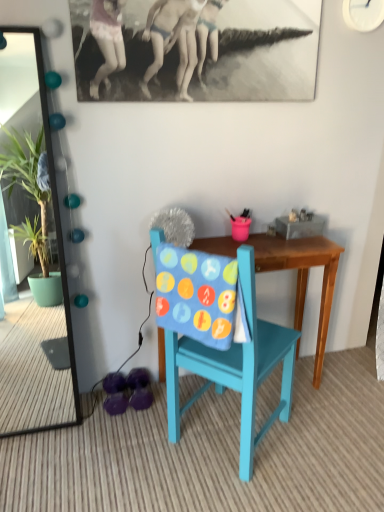
Where is `free point in front of wooden table at center`? The image size is (384, 512). free point in front of wooden table at center is located at coordinates click(x=263, y=474).